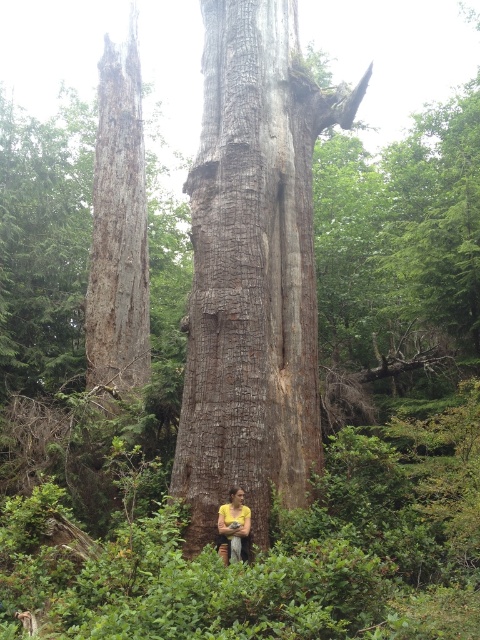
Is rough bark tree trunk at center to the left of yellow fabric person at center from the viewer's perspective?

Indeed, rough bark tree trunk at center is positioned on the left side of yellow fabric person at center.

Can you confirm if rough bark tree trunk at center is shorter than yellow fabric person at center?

Yes.

Which is in front, point (268, 416) or point (229, 534)?

Point (229, 534) is in front.

Where is `rough bark tree trunk at center`? Image resolution: width=480 pixels, height=640 pixels. rough bark tree trunk at center is located at coordinates (251, 272).